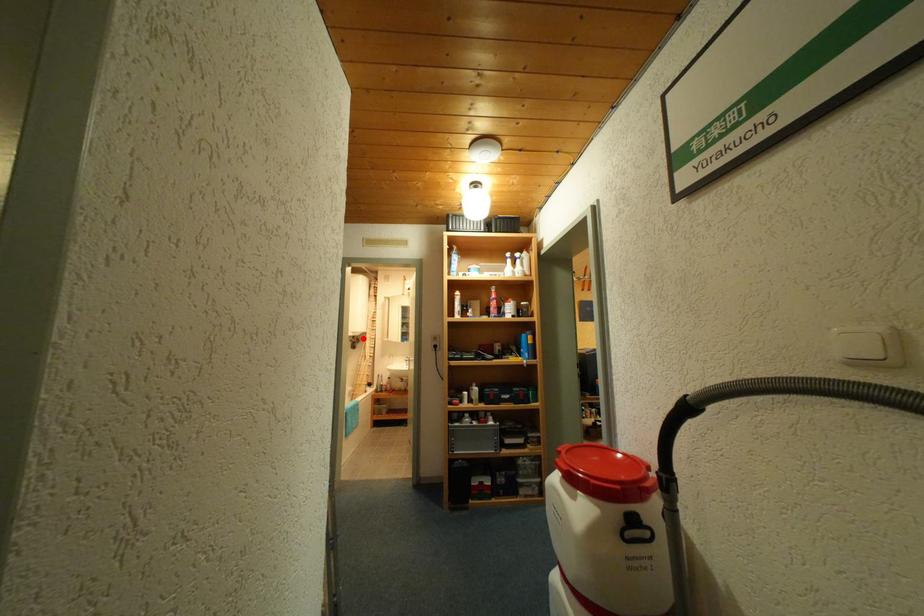
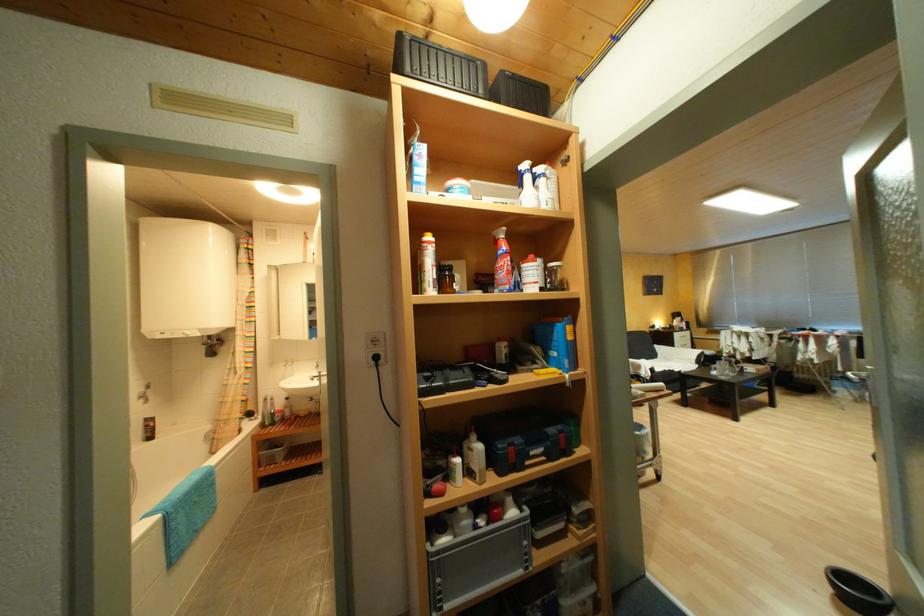
Locate, in the second image, the point that corresponds to the highlighted location in the first image.

(220, 338)